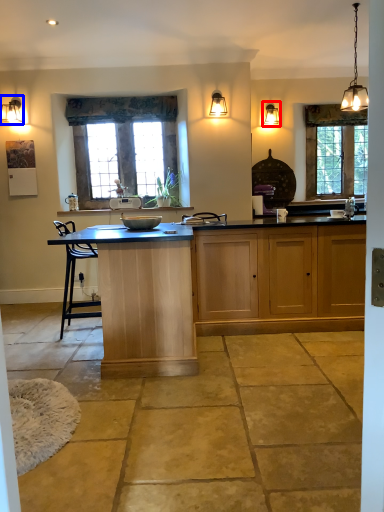
Question: Which of the following is the closest to the observer, light fixture (highlighted by a red box) or lamp (highlighted by a blue box)?

Choices:
 (A) light fixture
 (B) lamp

Answer: (B)